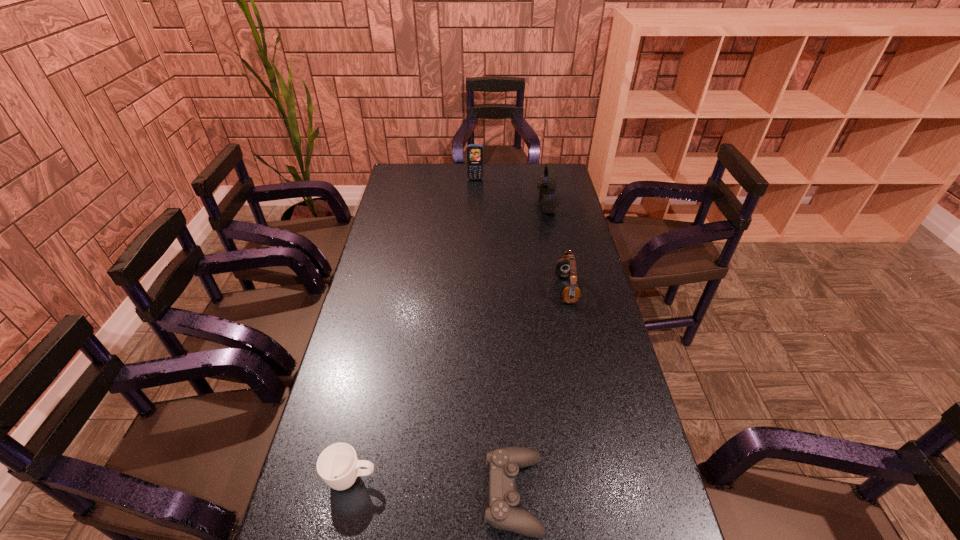
At what (x,y) coordinates should I click in order to perform the action: click on free area in between the cup and the farthest object. Please return your answer as a coordinate pair (x, y). This screenshot has height=540, width=960. Looking at the image, I should click on (414, 329).

The width and height of the screenshot is (960, 540). What are the coordinates of `free space between the farther headset and the cellular telephone` in the screenshot? It's located at (511, 192).

I want to click on free point between the leftmost object and the farthest object, so click(x=414, y=329).

Locate an element on the screen. free spot between the cellular telephone and the fourth tallest object is located at coordinates [414, 329].

Locate an element on the screen. The image size is (960, 540). empty location between the fourth nearest object and the shorter headset is located at coordinates (557, 247).

Identify the location of blank region between the farther headset and the cellular telephone. (511, 192).

Identify the location of free point between the farthest object and the shorter headset. The height and width of the screenshot is (540, 960). (521, 234).

Identify which object is the third nearest to the farthest object. Please provide its 2D coordinates. Your answer should be formatted as a tuple, i.e. [(x, y)], where the tuple contains the x and y coordinates of a point satisfying the conditions above.

[(504, 463)]

Locate which object ranks second in proximity to the farther headset. Please provide its 2D coordinates. Your answer should be formatted as a tuple, i.e. [(x, y)], where the tuple contains the x and y coordinates of a point satisfying the conditions above.

[(566, 267)]

This screenshot has height=540, width=960. Find the location of `free spot that satisfies the following two spatial constraints: 1. on the screen of the cellular telephone; 2. with the handle on the side of the leftmost object`. free spot that satisfies the following two spatial constraints: 1. on the screen of the cellular telephone; 2. with the handle on the side of the leftmost object is located at coordinates (470, 478).